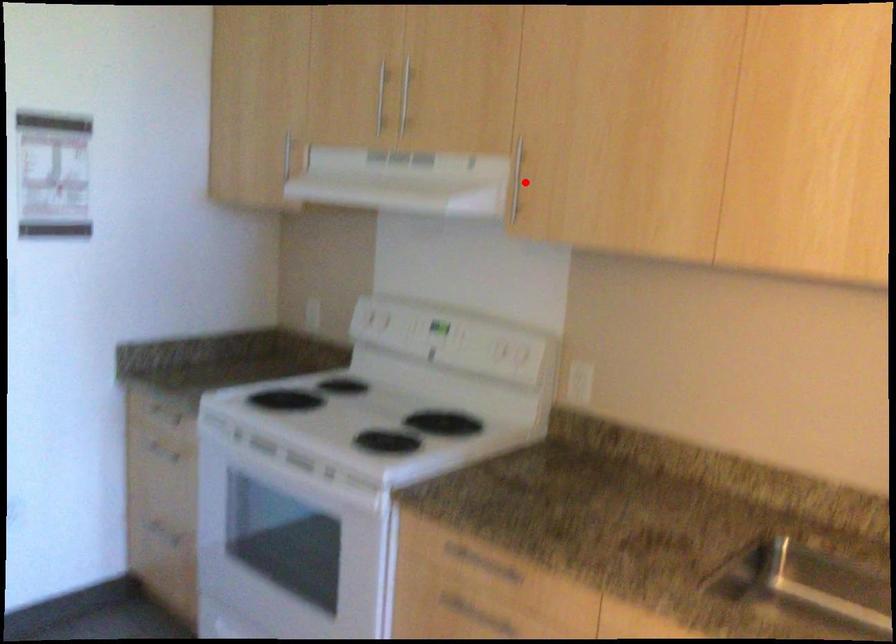
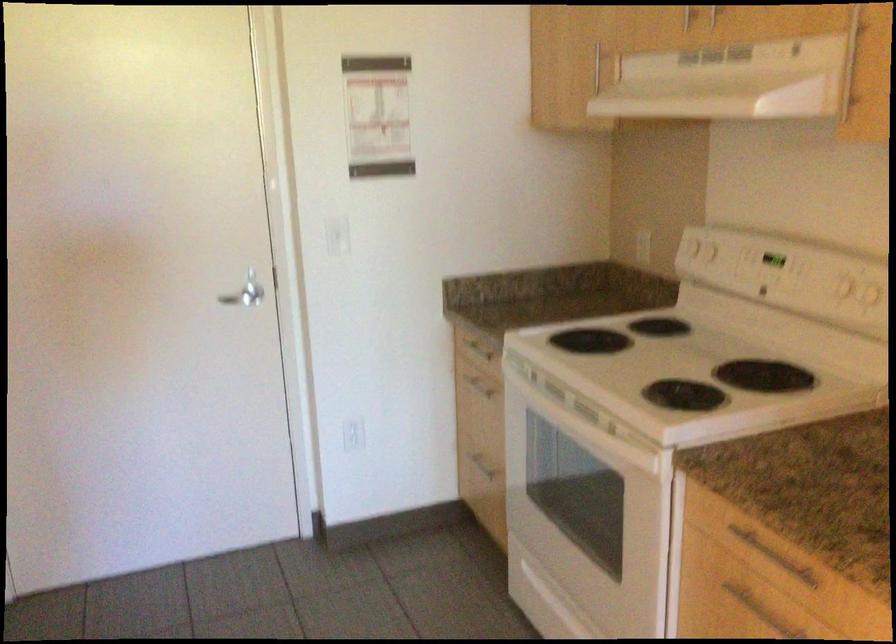
Question: I am providing you with two images of the same scene from different viewpoints. Image1 has a red point marked. In image2, the corresponding 3D location appears at what relative position? Reply with the corresponding letter.

Choices:
 (A) Closer
 (B) Farther

Answer: (A)